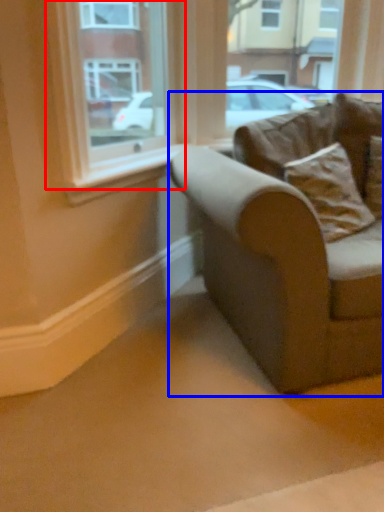
Question: Among these objects, which one is nearest to the camera, window (highlighted by a red box) or studio couch (highlighted by a blue box)?

Choices:
 (A) window
 (B) studio couch

Answer: (B)